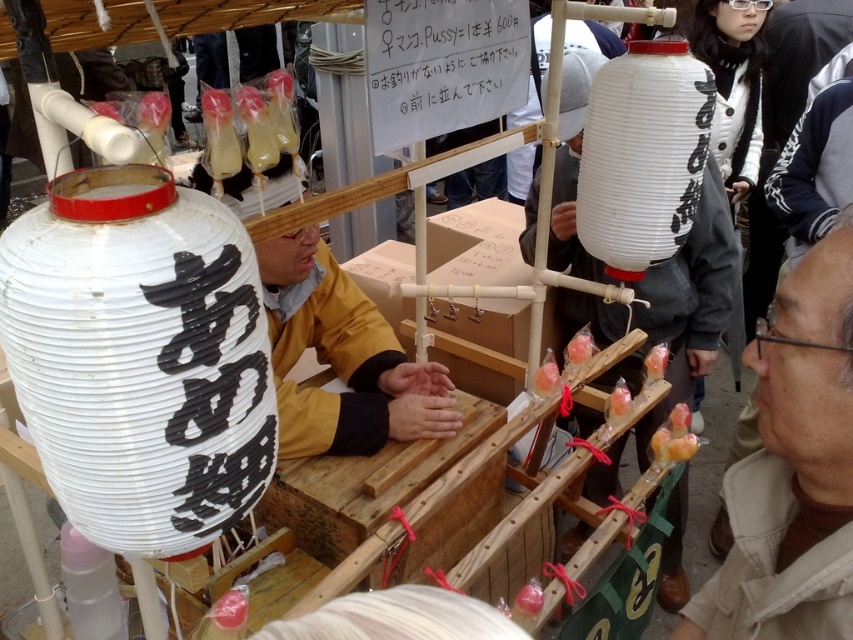
You are standing at the vendor stall and want to reach the two points marked in the image. Which point, point (241, 422) or point (511, 67), would you reach first if you move directly towards them?

Point (241, 422) is in front of point (511, 67), so you would reach point (241, 422) first.

You are a customer at the vendor stall and want to compare the sizes of the items you see. Which object is wider, the white paper lantern at left or the brown fabric jacket at lower right?

Result: The white paper lantern at left is wider than the brown fabric jacket at lower right according to the description.

Consider the image. You are a customer at the vendor stall. You notice the white paper lantern at left and the brown fabric jacket at lower right. Which object is closer to you as you stand in front of the stall?

The white paper lantern at left is closer to you because it is in front of the brown fabric jacket at lower right.